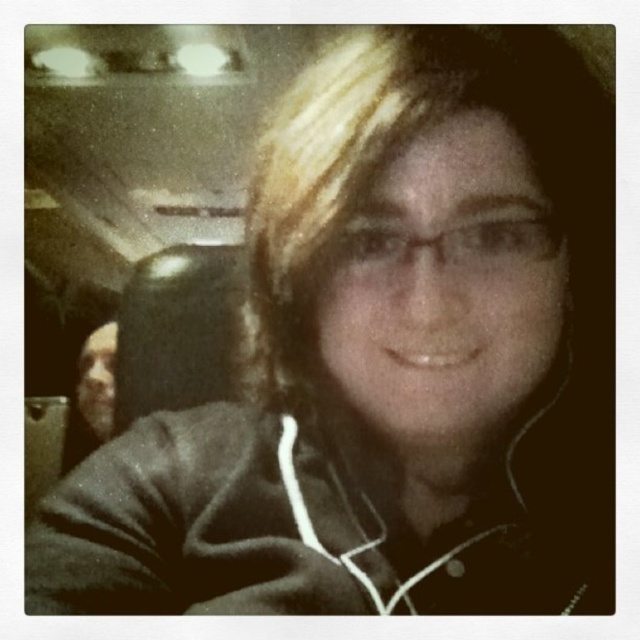
Question: From the image, what is the correct spatial relationship of blondehair at center in relation to smooth skin face at left?

Choices:
 (A) right
 (B) left

Answer: (A)

Question: Which point is closer to the camera taking this photo?

Choices:
 (A) (112, 388)
 (B) (385, 109)

Answer: (B)

Question: Can you confirm if blondehair at center is positioned to the left of smooth skin face at left?

Choices:
 (A) no
 (B) yes

Answer: (A)

Question: Which of the following is the farthest from the observer?

Choices:
 (A) blondehair at center
 (B) smooth skin face at left

Answer: (B)

Question: Which object appears closest to the camera in this image?

Choices:
 (A) blondehair at center
 (B) smooth skin face at left

Answer: (A)

Question: Can you confirm if blondehair at center is wider than smooth skin face at left?

Choices:
 (A) no
 (B) yes

Answer: (A)